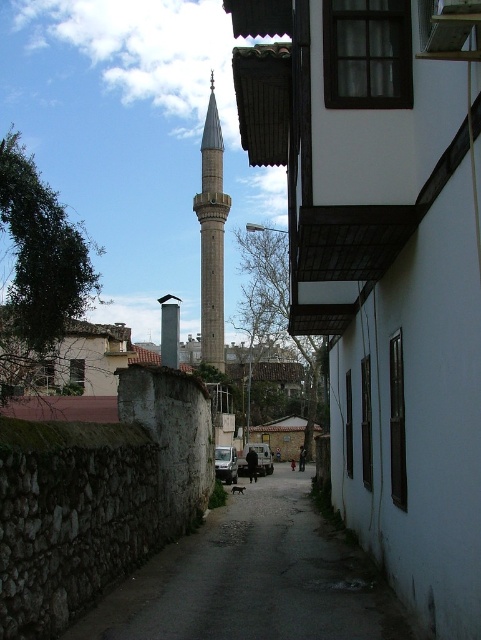
You are a delivery drone with a wingspan of 5 feet. You need to fly between the gray stone minaret at center and the smooth gray chimney at center. Can you safely navigate the space between them?

The distance between the gray stone minaret at center and the smooth gray chimney at center is 182.13 feet. Since your wingspan is only 5 feet, there is more than enough space for you to fly safely between them.

From the picture: You are a bird flying over the narrow street scene. You want to land on the tallest structure between the gray stone minaret at center and the smooth gray chimney at center. Which one should you choose?

The gray stone minaret at center is much taller than the smooth gray chimney at center, so you should choose the gray stone minaret at center to land on.